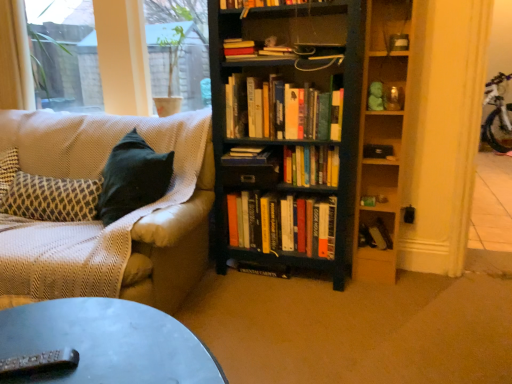
Identify the location of hardcover books at center, the fourth book viewed from the top. The image size is (512, 384). (311, 165).

This screenshot has width=512, height=384. Describe the element at coordinates (389, 25) in the screenshot. I see `wooden shelf at upper right, which is the 1th shelf in top-to-bottom order` at that location.

Locate an element on the screen. The height and width of the screenshot is (384, 512). hardcover book at center, the sixth book positioned from the top is located at coordinates (375, 236).

Image resolution: width=512 pixels, height=384 pixels. What do you see at coordinates (381, 142) in the screenshot?
I see `wooden shelves at right, placed as the first shelf when sorted from bottom to top` at bounding box center [381, 142].

You are a GUI agent. You are given a task and a screenshot of the screen. Output one action in this format:
    pyautogui.click(x=<x>, y=<y>)
    Task: Click on the dark wood bookcase at center
    The height and width of the screenshot is (384, 512).
    Given the screenshot: What is the action you would take?
    pyautogui.click(x=309, y=138)

Locate an element on the screen. transparent glass window at upper left, acting as the first window screen starting from the left is located at coordinates (65, 53).

Which is nearer, (272, 53) or (64, 212)?

Point (272, 53) is positioned closer to the camera compared to point (64, 212).

From a real-world perspective, between hardcover book at upper center, which is the sixth book in bottom-to-top order, and patterned fabric pillow at left, who is vertically higher?

hardcover book at upper center, which is the sixth book in bottom-to-top order, is physically above.

Is hardcover book at upper center, the 1th book from the top, situated inside patterned fabric pillow at left or outside?

hardcover book at upper center, the 1th book from the top, exists outside the volume of patterned fabric pillow at left.

From the image's perspective, would you say hardcover book at upper center, which is the sixth book in bottom-to-top order, is shown under patterned fabric pillow at left?

No.

Is textured beige couch at left further to the viewer compared to wooden shelf at upper right, the 2th shelf positioned from the bottom?

No, textured beige couch at left is closer to the camera.

From a real-world perspective, does textured beige couch at left stand above wooden shelf at upper right, the 2th shelf positioned from the bottom?

Actually, textured beige couch at left is physically below wooden shelf at upper right, the 2th shelf positioned from the bottom, in the real world.

Looking at the image, does textured beige couch at left seem bigger or smaller compared to wooden shelf at upper right, which is the 1th shelf in top-to-bottom order?

Considering their sizes, textured beige couch at left takes up more space than wooden shelf at upper right, which is the 1th shelf in top-to-bottom order.

Between textured beige couch at left and wooden shelf at upper right, which is the 1th shelf in top-to-bottom order, which one has less height?

wooden shelf at upper right, which is the 1th shelf in top-to-bottom order.

Is textured beige couch at left next to hardcover books at center, the 2th book when ordered from bottom to top, and touching it?

textured beige couch at left and hardcover books at center, the 2th book when ordered from bottom to top, are clearly separated.

From the image's perspective, is textured beige couch at left positioned above or below hardcover books at center, arranged as the fifth book when viewed from the top?

Clearly, from the image's perspective, textured beige couch at left is above hardcover books at center, arranged as the fifth book when viewed from the top.

Is textured beige couch at left positioned with its back to hardcover books at center, the 2th book when ordered from bottom to top?

→ textured beige couch at left does not have its back to hardcover books at center, the 2th book when ordered from bottom to top.

Between point (61, 127) and point (315, 246), which one is positioned in front?

The point (315, 246) is closer.

Between metallic gray remote control at lower left and wooden shelf at upper right, the 2th shelf positioned from the bottom, which one has smaller size?

Smaller between the two is metallic gray remote control at lower left.

Looking at their sizes, would you say metallic gray remote control at lower left is wider or thinner than wooden shelf at upper right, which is the 1th shelf in top-to-bottom order?

Considering their sizes, metallic gray remote control at lower left looks broader than wooden shelf at upper right, which is the 1th shelf in top-to-bottom order.

Is metallic gray remote control at lower left inside the boundaries of wooden shelf at upper right, the 2th shelf positioned from the bottom, or outside?

metallic gray remote control at lower left is not enclosed by wooden shelf at upper right, the 2th shelf positioned from the bottom.

Looking at this image, is metallic gray remote control at lower left to the left or to the right of wooden shelf at upper right, which is the 1th shelf in top-to-bottom order, in the image?

metallic gray remote control at lower left is positioned on wooden shelf at upper right, which is the 1th shelf in top-to-bottom order,'s left side.

Is the surface of hardcover books at center, arranged as the fifth book when viewed from the top, in direct contact with hardcover books at center, marked as the 2th book in a top-to-bottom arrangement?

No, hardcover books at center, arranged as the fifth book when viewed from the top, is not beside hardcover books at center, marked as the 2th book in a top-to-bottom arrangement.

Is hardcover books at center, arranged as the 5th book when ordered from the bottom, inside hardcover books at center, arranged as the fifth book when viewed from the top?

No, hardcover books at center, arranged as the 5th book when ordered from the bottom, is not a part of hardcover books at center, arranged as the fifth book when viewed from the top.

Is point (230, 221) closer or farther from the camera than point (325, 116)?

Point (230, 221) appears to be farther away from the viewer than point (325, 116).

Which object is closer to the camera taking this photo, hardcover books at center, arranged as the fifth book when viewed from the top, or hardcover books at center, marked as the 2th book in a top-to-bottom arrangement?

hardcover books at center, marked as the 2th book in a top-to-bottom arrangement, is more forward.

From the picture: From a real-world perspective, is metallic gray remote control at lower left physically above transparent glass window at upper left, which ranks as the 2th window screen in right-to-left order?

No, from a real-world perspective, metallic gray remote control at lower left is not on top of transparent glass window at upper left, which ranks as the 2th window screen in right-to-left order.

Between metallic gray remote control at lower left and transparent glass window at upper left, acting as the first window screen starting from the left, which one has larger width?

With larger width is transparent glass window at upper left, acting as the first window screen starting from the left.

Is transparent glass window at upper left, acting as the first window screen starting from the left, located within metallic gray remote control at lower left?

No, metallic gray remote control at lower left does not contain transparent glass window at upper left, acting as the first window screen starting from the left.

Is metallic gray remote control at lower left behind transparent glass window at upper left, which ranks as the 2th window screen in right-to-left order?

No, metallic gray remote control at lower left is closer to the camera.

From the picture: Does transparent glass window screen at upper left, which is the 2th window screen from left to right, have a smaller size compared to textured beige couch at left?

Correct, transparent glass window screen at upper left, which is the 2th window screen from left to right, occupies less space than textured beige couch at left.

Is transparent glass window screen at upper left, which is counted as the first window screen, starting from the right, to the left or to the right of textured beige couch at left in the image?

From the image, it's evident that transparent glass window screen at upper left, which is counted as the first window screen, starting from the right, is to the right of textured beige couch at left.

Does transparent glass window screen at upper left, which is the 2th window screen from left to right, have a greater width compared to textured beige couch at left?

No, transparent glass window screen at upper left, which is the 2th window screen from left to right, is not wider than textured beige couch at left.

From a real-world perspective, is transparent glass window screen at upper left, which is the 2th window screen from left to right, above or below textured beige couch at left?

transparent glass window screen at upper left, which is the 2th window screen from left to right, is situated higher than textured beige couch at left in the real world.

Where is `pillow below the hardcover book at upper center, which is the sixth book in bottom-to-top order (from the image's perspective)`? pillow below the hardcover book at upper center, which is the sixth book in bottom-to-top order (from the image's perspective) is located at coordinates (51, 198).

At what (x,y) coordinates should I click in order to perform the action: click on studio couch on the left side of wooden shelf at upper right, the 2th shelf positioned from the bottom. Please return your answer as a coordinate pair (x, y). The width and height of the screenshot is (512, 384). Looking at the image, I should click on (114, 223).

Based on the photo, when comparing their distances from hardcover book at center, which appears as the first book when ordered from the bottom, does hardcover books at center, the 2th book when ordered from bottom to top, or hardcover book at center, positioned as the fourth book in bottom-to-top order, seem further?

Based on the image, hardcover book at center, positioned as the fourth book in bottom-to-top order, appears to be further to hardcover book at center, which appears as the first book when ordered from the bottom.

Based on their spatial positions, is wooden shelf at upper right, the 2th shelf positioned from the bottom, or hardcover book at center, which appears as the first book when ordered from the bottom, further from hardcover book at upper center, which is the sixth book in bottom-to-top order?

Based on the image, hardcover book at center, which appears as the first book when ordered from the bottom, appears to be further to hardcover book at upper center, which is the sixth book in bottom-to-top order.

Considering their positions, is wooden shelf at upper right, the 2th shelf positioned from the bottom, positioned closer to transparent glass window screen at upper left, which is counted as the first window screen, starting from the right, than hardcover books at center, arranged as the 5th book when ordered from the bottom?

hardcover books at center, arranged as the 5th book when ordered from the bottom, is positioned closer to the anchor transparent glass window screen at upper left, which is counted as the first window screen, starting from the right.

From the image, which object appears to be nearer to transparent glass window at upper left, which ranks as the 2th window screen in right-to-left order, transparent glass window screen at upper left, which is counted as the first window screen, starting from the right, or hardcover books at center, the 2th book when ordered from bottom to top?

The object closer to transparent glass window at upper left, which ranks as the 2th window screen in right-to-left order, is transparent glass window screen at upper left, which is counted as the first window screen, starting from the right.

From the image, which object appears to be farther from transparent glass window at upper left, which ranks as the 2th window screen in right-to-left order, hardcover books at center, the fourth book viewed from the top, or wooden shelves at right, placed as the first shelf when sorted from bottom to top?

wooden shelves at right, placed as the first shelf when sorted from bottom to top, is further to transparent glass window at upper left, which ranks as the 2th window screen in right-to-left order.

Looking at the image, which one is located further to transparent glass window screen at upper left, which is counted as the first window screen, starting from the right, metallic gray remote control at lower left or dark wood bookcase at center?

metallic gray remote control at lower left is further to transparent glass window screen at upper left, which is counted as the first window screen, starting from the right.

When comparing their distances from transparent glass window at upper left, acting as the first window screen starting from the left, does dark wood bookcase at center or hardcover book at center, which appears as the first book when ordered from the bottom, seem further?

hardcover book at center, which appears as the first book when ordered from the bottom, lies further to transparent glass window at upper left, acting as the first window screen starting from the left, than the other object.

Considering their positions, is hardcover books at center, which is the third book from bottom to top, positioned further to dark wood bookcase at center than textured beige couch at left?

textured beige couch at left is positioned further to the anchor dark wood bookcase at center.

Where is `shelf between hardcover books at center, marked as the 2th book in a top-to-bottom arrangement, and hardcover book at center, the sixth book positioned from the top, in the vertical direction`? This screenshot has height=384, width=512. shelf between hardcover books at center, marked as the 2th book in a top-to-bottom arrangement, and hardcover book at center, the sixth book positioned from the top, in the vertical direction is located at coordinates (381, 142).

Locate an element on the screen. This screenshot has width=512, height=384. studio couch between metallic gray remote control at lower left and hardcover books at center, arranged as the fifth book when viewed from the top, along the z-axis is located at coordinates coord(114,223).

The width and height of the screenshot is (512, 384). Identify the location of window screen between transparent glass window at upper left, which ranks as the 2th window screen in right-to-left order, and wooden shelves at right, placed as the first shelf when sorted from bottom to top. (178, 48).

I want to click on pillow between metallic gray remote control at lower left and transparent glass window at upper left, which ranks as the 2th window screen in right-to-left order, along the z-axis, so pos(51,198).